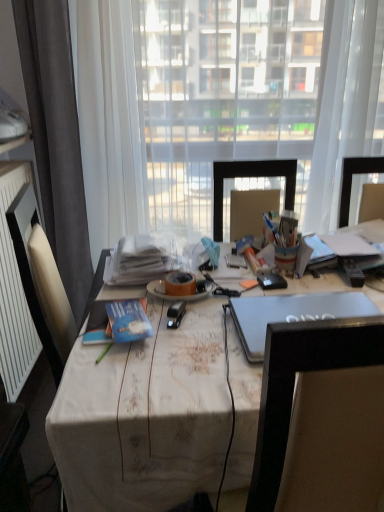
This screenshot has width=384, height=512. What are the coordinates of `transparent fabric at center` in the screenshot? It's located at (221, 93).

The width and height of the screenshot is (384, 512). Describe the element at coordinates (291, 314) in the screenshot. I see `sleek silver laptop at center` at that location.

What is the approximate width of sleek silver laptop at center?

sleek silver laptop at center is 10.66 inches in width.

In order to face translucent orange adhesive tape at center, should I rotate leftwards or rightwards?

To align with it, rotate left about 1.486°.

This screenshot has height=512, width=384. Identify the location of white textured radiator at left. (14, 293).

From the image's perspective, which one is positioned lower, white textured radiator at left or translucent orange adhesive tape at center?

white textured radiator at left appears lower in the image.

Based on their positions, is white textured radiator at left located to the left or right of translucent orange adhesive tape at center?

white textured radiator at left is positioned on translucent orange adhesive tape at center's left side.

From a real-world perspective, does white textured radiator at left stand above translucent orange adhesive tape at center?

No, from a real-world perspective, white textured radiator at left is not over translucent orange adhesive tape at center

Locate an element on the screen. radiator that appears on the left of translucent orange adhesive tape at center is located at coordinates (14, 293).

Is point (316, 310) closer to camera compared to point (167, 274)?

Yes, it is.

Does sleek silver laptop at center appear on the left side of translucent orange adhesive tape at center?

Incorrect, sleek silver laptop at center is not on the left side of translucent orange adhesive tape at center.

From the image's perspective, which is below, sleek silver laptop at center or translucent orange adhesive tape at center?

From the image's view, sleek silver laptop at center is below.

Can you confirm if white paper stack at center, the first book from the back, is positioned to the right of blue matte book at center, the 1th book ordered from the bottom?

Indeed, white paper stack at center, the first book from the back, is positioned on the right side of blue matte book at center, the 1th book ordered from the bottom.

Which of these two, white paper stack at center, positioned as the first book in top-to-bottom order, or blue matte book at center, placed as the second book when sorted from top to bottom, stands shorter?

blue matte book at center, placed as the second book when sorted from top to bottom, is shorter.

Where is `book lying below the white paper stack at center, marked as the second book in a bottom-to-top arrangement (from the image's perspective)`? book lying below the white paper stack at center, marked as the second book in a bottom-to-top arrangement (from the image's perspective) is located at coordinates pos(128,321).

At what (x,y) coordinates should I click in order to perform the action: click on book above the translucent orange adhesive tape at center (from the image's perspective). Please return your answer as a coordinate pair (x, y). The image size is (384, 512). Looking at the image, I should click on (138, 261).

From the image's perspective, is translucent orange adhesive tape at center below white paper stack at center, the first book from the back?

Yes, from the image's perspective, translucent orange adhesive tape at center is below white paper stack at center, the first book from the back.

Is translucent orange adhesive tape at center bigger or smaller than white paper stack at center, marked as the second book in a bottom-to-top arrangement?

translucent orange adhesive tape at center is smaller than white paper stack at center, marked as the second book in a bottom-to-top arrangement.

Consider the image. Which is more to the right, translucent orange adhesive tape at center or white paper stack at center, marked as the second book in a bottom-to-top arrangement?

translucent orange adhesive tape at center.

Does transparent fabric at center turn towards sleek silver laptop at center?

Yes, transparent fabric at center is turned towards sleek silver laptop at center.

I want to click on window screen on the left of sleek silver laptop at center, so click(x=221, y=93).

Can sleek silver laptop at center be found inside transparent fabric at center?

No, sleek silver laptop at center is not surrounded by transparent fabric at center.

From the image's perspective, which object appears higher, transparent fabric at center or sleek silver laptop at center?

transparent fabric at center appears higher in the image.

Who is more distant, sleek silver laptop at center or white paper stack at center, the first book from the back?

white paper stack at center, the first book from the back.

From a real-world perspective, is sleek silver laptop at center under white paper stack at center, the second book in the front-to-back sequence?

Yes, from a real-world perspective, sleek silver laptop at center is under white paper stack at center, the second book in the front-to-back sequence.

Which object is wider, sleek silver laptop at center or white paper stack at center, the second book in the front-to-back sequence?

With larger width is white paper stack at center, the second book in the front-to-back sequence.

Would you say gray fabric curtain at left is to the left or to the right of white fabric-covered desk at center in the picture?

From the image, it's evident that gray fabric curtain at left is to the left of white fabric-covered desk at center.

Can we say gray fabric curtain at left lies outside white fabric-covered desk at center?

That's correct, gray fabric curtain at left is outside of white fabric-covered desk at center.

Is point (73, 261) in front of point (381, 296)?

That is False.

I want to click on adhesive tape above the white textured radiator at left (from a real-world perspective), so click(180, 284).

Where is `laptop in front of the translucent orange adhesive tape at center`? Image resolution: width=384 pixels, height=512 pixels. laptop in front of the translucent orange adhesive tape at center is located at coordinates (291, 314).

Considering their positions, is orange matte plate at center positioned closer to translucent orange adhesive tape at center than white fabric-covered desk at center?

orange matte plate at center.

Estimate the real-world distances between objects in this image. Which object is further from white textured radiator at left, sleek silver laptop at center or blue matte book at center, placed as the second book when sorted from top to bottom?

Among the two, sleek silver laptop at center is located further to white textured radiator at left.

Considering their positions, is sleek silver laptop at center positioned closer to blue matte book at center, the 1th book ordered from the bottom, than orange matte plate at center?

Among the two, orange matte plate at center is located nearer to blue matte book at center, the 1th book ordered from the bottom.

When comparing their distances from white textured radiator at left, does orange matte plate at center or translucent orange adhesive tape at center seem further?

translucent orange adhesive tape at center is positioned further to the anchor white textured radiator at left.

From the image, which object appears to be nearer to white paper stack at center, marked as the second book in a bottom-to-top arrangement, orange matte plate at center or white fabric-covered desk at center?

orange matte plate at center is closer to white paper stack at center, marked as the second book in a bottom-to-top arrangement.

Which object lies further to the anchor point gray fabric curtain at left, orange matte plate at center or sleek silver laptop at center?

sleek silver laptop at center lies further to gray fabric curtain at left than the other object.

Considering their positions, is sleek silver laptop at center positioned further to transparent fabric at center than translucent orange adhesive tape at center?

sleek silver laptop at center lies further to transparent fabric at center than the other object.

Estimate the real-world distances between objects in this image. Which object is further from blue matte book at center, the 1th book ordered from the bottom, orange matte plate at center or white paper stack at center, marked as the second book in a bottom-to-top arrangement?

white paper stack at center, marked as the second book in a bottom-to-top arrangement, is positioned further to the anchor blue matte book at center, the 1th book ordered from the bottom.

Find the location of a particular element. Image resolution: width=384 pixels, height=512 pixels. plate situated between gray fabric curtain at left and transparent fabric at center from left to right is located at coordinates (178, 296).

At what (x,y) coordinates should I click in order to perform the action: click on desk situated between blue matte book at center, the 1th book ordered from the bottom, and sleek silver laptop at center from left to right. Please return your answer as a coordinate pair (x, y). This screenshot has height=512, width=384. Looking at the image, I should click on (372, 230).

In order to click on plate located between white paper stack at center, positioned as the first book in top-to-bottom order, and sleek silver laptop at center in the left-right direction in this screenshot , I will do `click(178, 296)`.

You are a GUI agent. You are given a task and a screenshot of the screen. Output one action in this format:
    pyautogui.click(x=<x>, y=<y>)
    Task: Click on the curtain between blue matte book at center, placed as the second book when sorted from top to bottom, and transparent fabric at center, along the z-axis
    
    Given the screenshot: What is the action you would take?
    pyautogui.click(x=56, y=138)